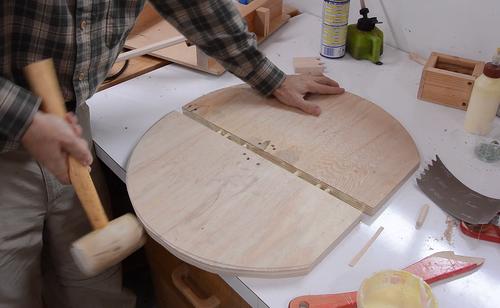
This screenshot has width=500, height=308. I want to click on wooden screws, so click(x=423, y=215), click(x=327, y=189), click(x=318, y=184), click(x=295, y=172), click(x=244, y=146), click(x=226, y=136), click(x=220, y=132).